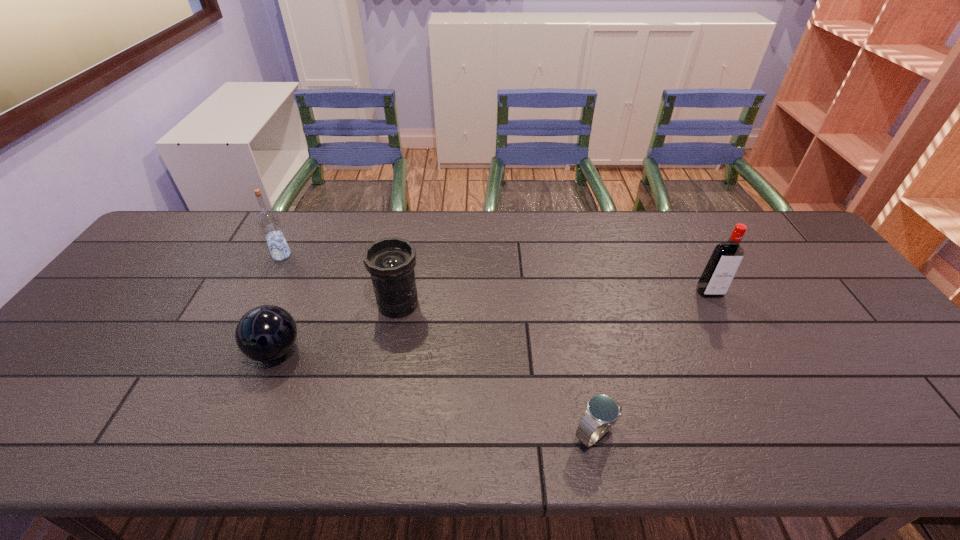
You are a GUI agent. You are given a task and a screenshot of the screen. Output one action in this format:
    pyautogui.click(x=<x>, y=<y>)
    Task: Click on the left vodka
    This screenshot has height=540, width=960.
    Given the screenshot: What is the action you would take?
    pyautogui.click(x=268, y=220)

Where is `the leftmost object`? the leftmost object is located at coordinates (268, 220).

Image resolution: width=960 pixels, height=540 pixels. Find the location of `the right vodka`. the right vodka is located at coordinates click(x=724, y=262).

This screenshot has width=960, height=540. I want to click on the nearer vodka, so click(724, 262).

Identify the location of the third object from left to right. (390, 261).

Where is `telephoto lens`? Image resolution: width=960 pixels, height=540 pixels. telephoto lens is located at coordinates (390, 261).

Find the location of `the second object from left to right`. the second object from left to right is located at coordinates (265, 333).

Where is `the fourth tallest object`? the fourth tallest object is located at coordinates (265, 333).

What are the coordinates of `watch` in the screenshot? It's located at (602, 411).

Image resolution: width=960 pixels, height=540 pixels. What are the coordinates of `the second object from right to left` in the screenshot? It's located at (602, 411).